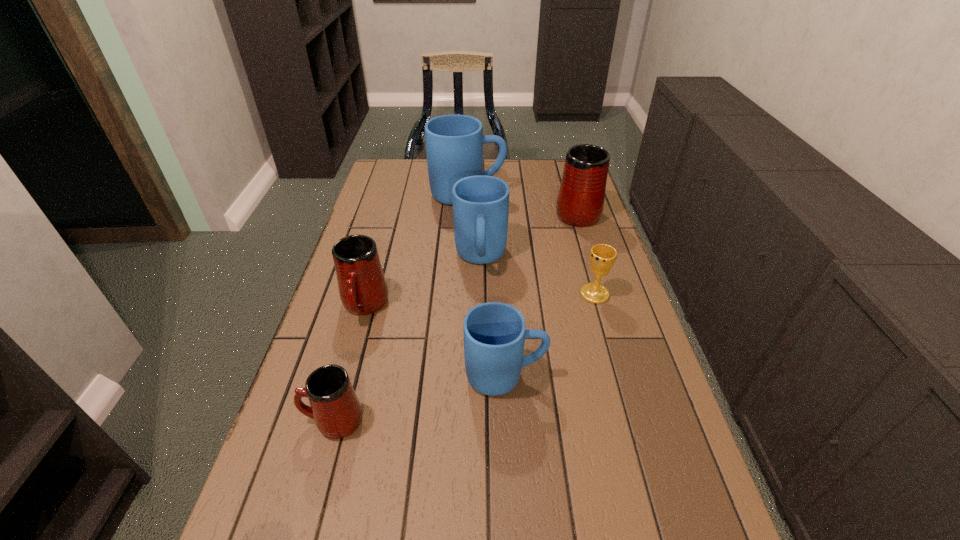
I want to click on object located in the far edge section of the desktop, so click(454, 143).

You are a GUI agent. You are given a task and a screenshot of the screen. Output one action in this format:
    pyautogui.click(x=<x>, y=<y>)
    Task: Click on the mug positioned at the right edge
    The height and width of the screenshot is (540, 960).
    Given the screenshot: What is the action you would take?
    pyautogui.click(x=580, y=202)

At what (x,y) coordinates should I click in order to perform the action: click on chalice at the right edge. Please return your answer as a coordinate pair (x, y). Image resolution: width=960 pixels, height=540 pixels. Looking at the image, I should click on (602, 256).

Where is `free space at the left edge`? This screenshot has width=960, height=540. free space at the left edge is located at coordinates (307, 498).

You are a GUI agent. You are given a task and a screenshot of the screen. Output one action in this format:
    pyautogui.click(x=<x>, y=<y>)
    Task: Click on the vacant point at the right edge
    
    Given the screenshot: What is the action you would take?
    pyautogui.click(x=620, y=272)

Identify the location of free spot at the far left corner of the desktop. click(x=390, y=188).

This screenshot has height=540, width=960. Identify the location of free spot between the farthest blue mug and the rightmost red mug. (522, 203).

At what (x,y) coordinates should I click in order to perform the action: click on vacant space that is in between the second biggest red mug and the fifth nearest object. Please return your answer as a coordinate pair (x, y). Looking at the image, I should click on (422, 282).

The image size is (960, 540). Find the location of `unoccupied position between the second biggest blue mug and the third nearest mug`. unoccupied position between the second biggest blue mug and the third nearest mug is located at coordinates (422, 282).

You are a GUI agent. You are given a task and a screenshot of the screen. Output one action in this format:
    pyautogui.click(x=<x>, y=<y>)
    Task: Click on the free space between the third nearest mug and the smallest blue mug
    
    Given the screenshot: What is the action you would take?
    pyautogui.click(x=435, y=341)